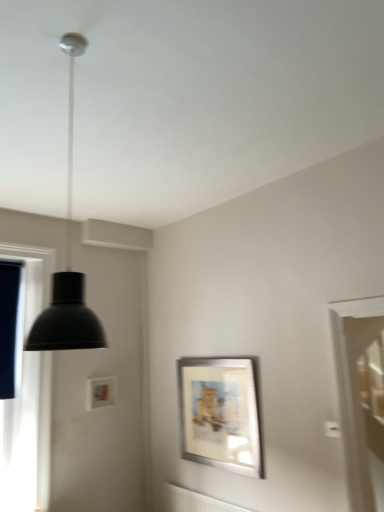
Question: Is the surface of white glossy screen door at right in direct contact with silver metallic picture frame at center?

Choices:
 (A) no
 (B) yes

Answer: (A)

Question: Considering the relative sizes of white glossy screen door at right and silver metallic picture frame at center in the image provided, is white glossy screen door at right bigger than silver metallic picture frame at center?

Choices:
 (A) yes
 (B) no

Answer: (A)

Question: From a real-world perspective, is white glossy screen door at right physically above silver metallic picture frame at center?

Choices:
 (A) yes
 (B) no

Answer: (A)

Question: Considering the relative sizes of white glossy screen door at right and silver metallic picture frame at center in the image provided, is white glossy screen door at right thinner than silver metallic picture frame at center?

Choices:
 (A) yes
 (B) no

Answer: (B)

Question: Is white glossy screen door at right shorter than silver metallic picture frame at center?

Choices:
 (A) no
 (B) yes

Answer: (A)

Question: Is silver metallic picture frame at center located within white glossy screen door at right?

Choices:
 (A) no
 (B) yes

Answer: (A)

Question: Considering the relative sizes of silver metallic picture frame at center and matte black pendant light at upper left in the image provided, is silver metallic picture frame at center smaller than matte black pendant light at upper left?

Choices:
 (A) yes
 (B) no

Answer: (A)

Question: Can you confirm if silver metallic picture frame at center is taller than matte black pendant light at upper left?

Choices:
 (A) no
 (B) yes

Answer: (A)

Question: Is silver metallic picture frame at center bigger than matte black pendant light at upper left?

Choices:
 (A) yes
 (B) no

Answer: (B)

Question: Does silver metallic picture frame at center turn towards matte black pendant light at upper left?

Choices:
 (A) no
 (B) yes

Answer: (A)

Question: Is matte black pendant light at upper left located within silver metallic picture frame at center?

Choices:
 (A) yes
 (B) no

Answer: (B)

Question: Can you confirm if silver metallic picture frame at center is shorter than matte black pendant light at upper left?

Choices:
 (A) no
 (B) yes

Answer: (B)

Question: From a real-world perspective, is matte black pendant light at upper left physically above silver metallic picture frame at center?

Choices:
 (A) yes
 (B) no

Answer: (A)